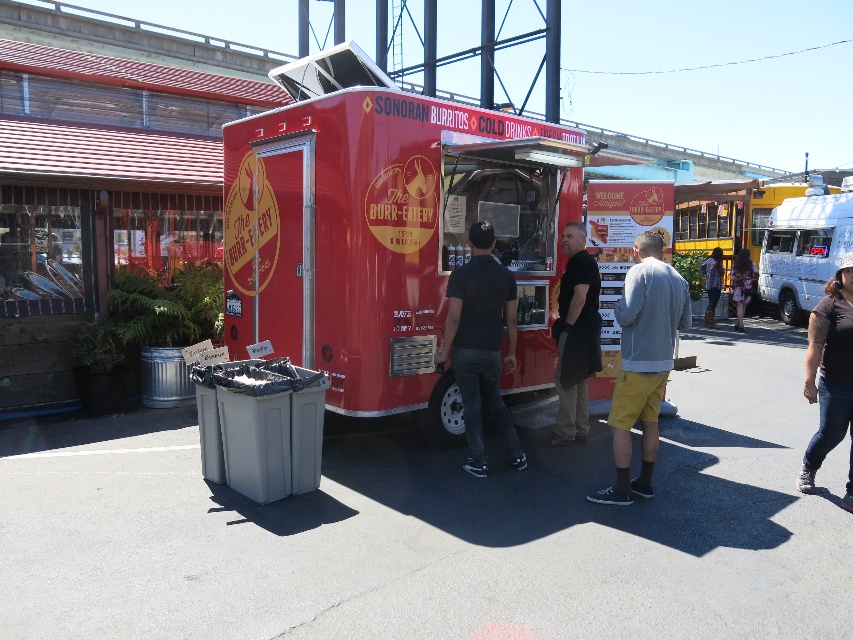
Which is behind, point (503, 428) or point (711, 305)?

Point (711, 305)

From the picture: Who is more distant from viewer, (468,291) or (718,289)?

The point (718,289) is more distant.

You are a GUI agent. You are given a task and a screenshot of the screen. Output one action in this format:
    pyautogui.click(x=<x>, y=<y>)
    Task: Click on the black matte shirt at center
    This screenshot has width=853, height=640.
    Given the screenshot: What is the action you would take?
    pyautogui.click(x=480, y=342)

Between white glossy food truck at right and dark brown leather jacket at center, which one is positioned higher?

white glossy food truck at right

Is point (737, 216) positioned behind point (572, 364)?

Yes, it is.

What do you see at coordinates (762, 227) in the screenshot? I see `white glossy food truck at right` at bounding box center [762, 227].

Find the location of a particular element. white glossy food truck at right is located at coordinates (762, 227).

Between point (518, 220) and point (676, 284), which one is positioned in front?

Point (676, 284) is more forward.

Who is positioned more to the left, shiny red food truck at center or gray fleece jacket at center?

Positioned to the left is shiny red food truck at center.

Does point (234, 273) lie in front of point (659, 253)?

No.

Image resolution: width=853 pixels, height=640 pixels. In order to click on shiny red food truck at center in this screenshot , I will do `click(375, 234)`.